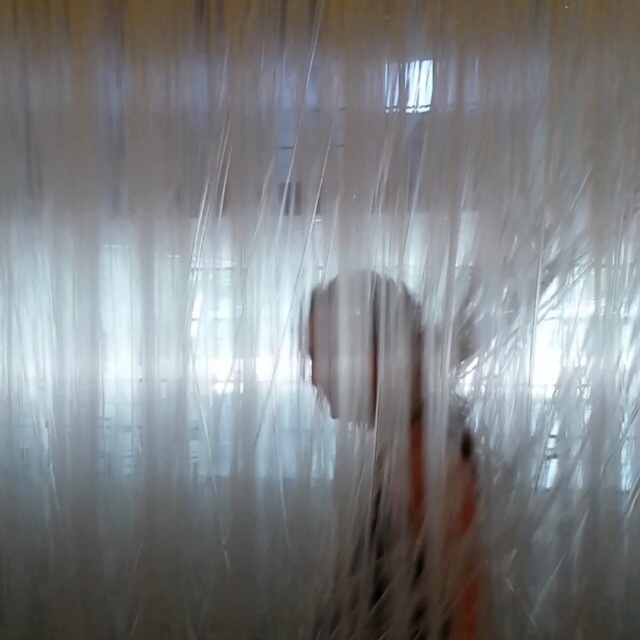
Who is more distant from viewer, (x=371, y=406) or (x=412, y=86)?

The point (x=371, y=406) is behind.

Is the position of metallic silver phone at center less distant than that of transparent plastic window at upper center?

No.

You are a GUI agent. You are given a task and a screenshot of the screen. Output one action in this format:
    pyautogui.click(x=<x>, y=<y>)
    Task: Click on the metallic silver phone at center
    
    Given the screenshot: What is the action you would take?
    pyautogui.click(x=374, y=385)